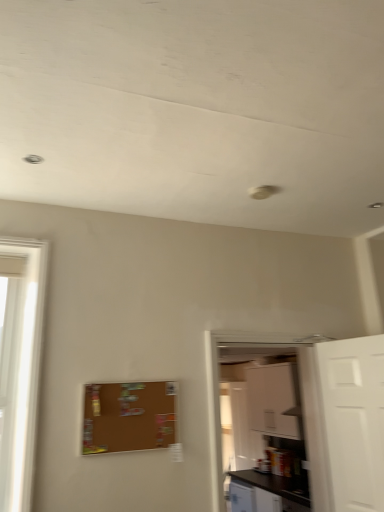
Question: Is black laminate counter top at lower right taller or shorter than corkboard at center?

Choices:
 (A) tall
 (B) short

Answer: (A)

Question: In the image, is black laminate counter top at lower right positioned in front of or behind corkboard at center?

Choices:
 (A) behind
 (B) front

Answer: (A)

Question: Which object is positioned closest to the black laminate counter top at lower right?

Choices:
 (A) white matte cabinet at upper right
 (B) white matte door at right
 (C) white glossy cabinet at right
 (D) corkboard at center

Answer: (A)

Question: Which of these objects is positioned farthest from the black laminate counter top at lower right?

Choices:
 (A) white matte door at right
 (B) corkboard at center
 (C) white glossy cabinet at right
 (D) white matte cabinet at upper right

Answer: (B)